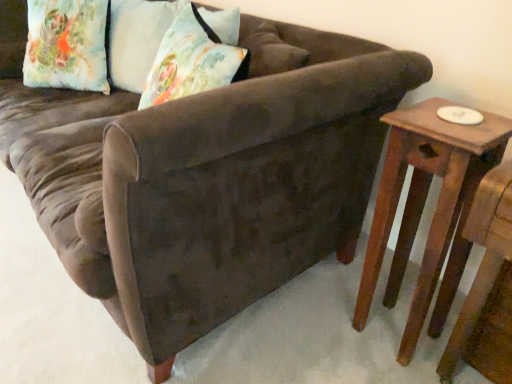
Find the location of a particular element. The height and width of the screenshot is (384, 512). vacant space underneath wooden side table at right (from a real-world perspective) is located at coordinates (388, 327).